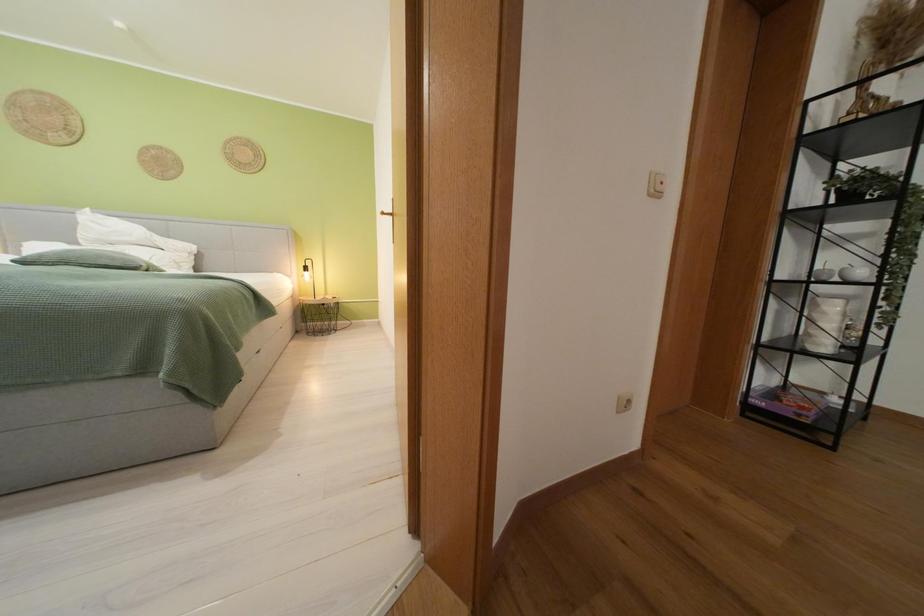
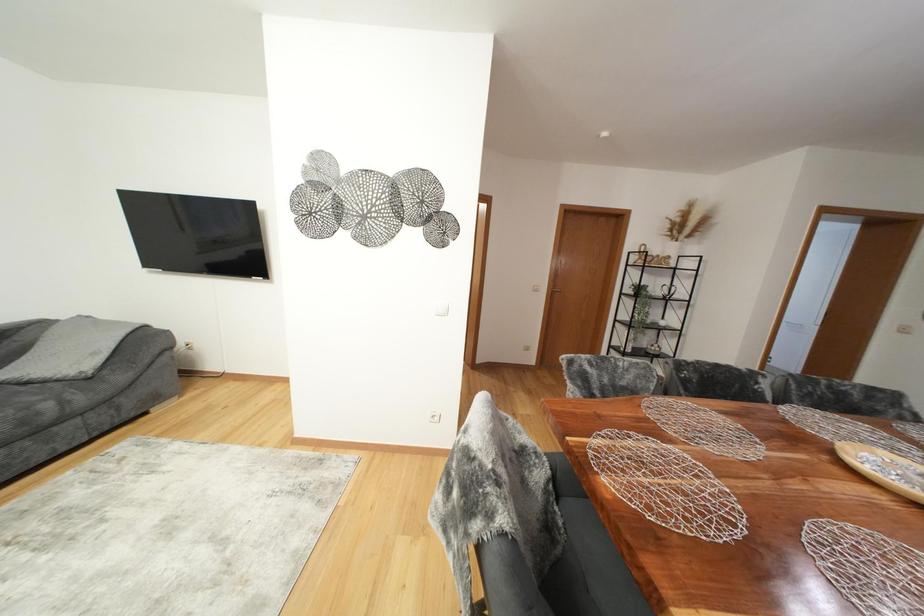
Looking at this image, the images are taken continuously from a first-person perspective. In which direction are you moving?

The movement direction of the cameraman is right, backward.